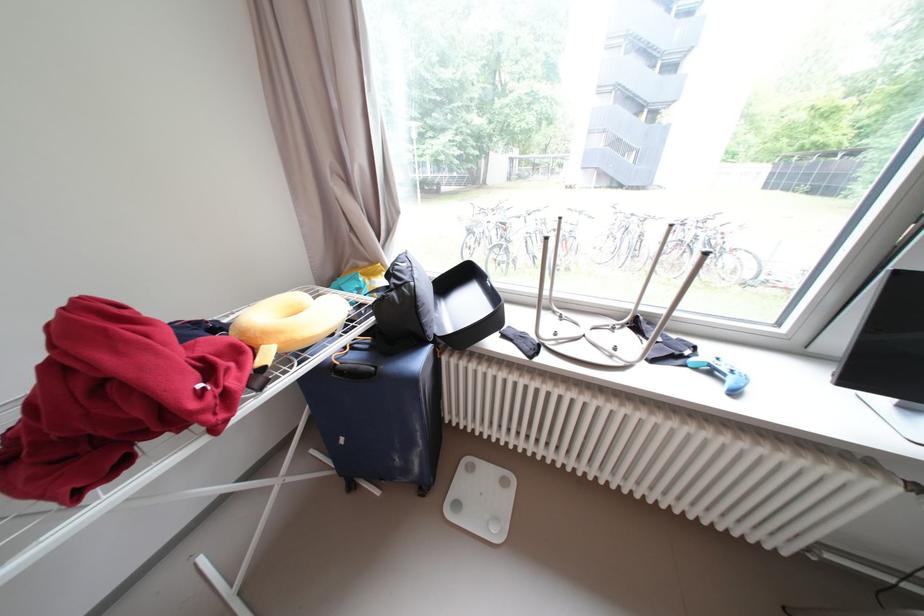
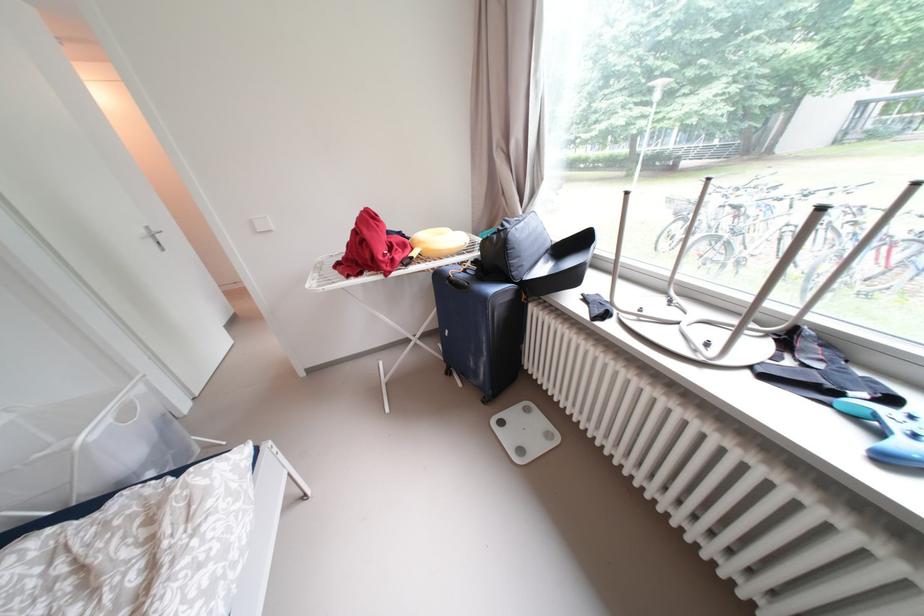
Question: The camera is either moving clockwise (left) or counter-clockwise (right) around the object. The first image is from the beginning of the video and the second image is from the end. Is the camera moving left or right when shooting the video?

Choices:
 (A) Left
 (B) Right

Answer: (B)